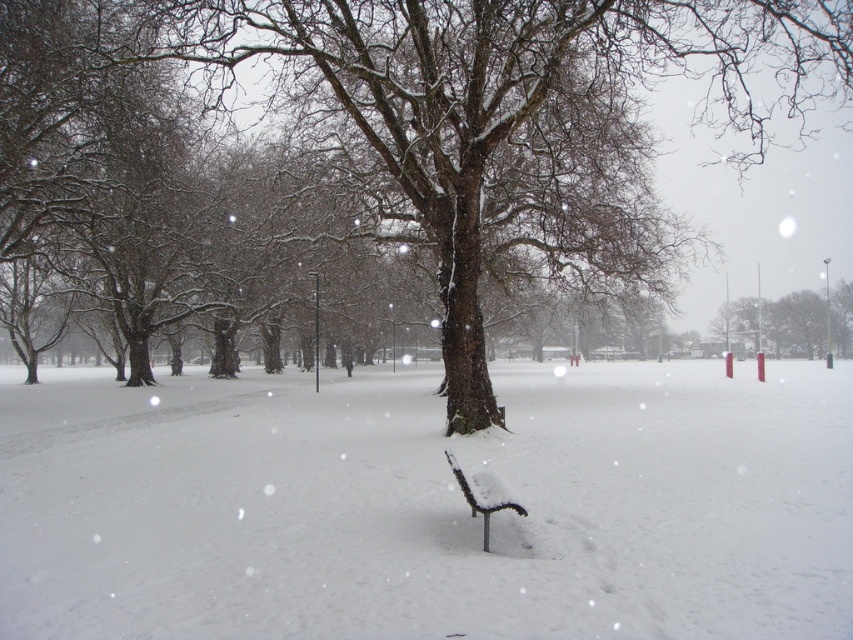
Is smooth red pole at center closer to camera compared to snow-covered wood bench at center?

That is False.

Find the location of a particular element. smooth red pole at center is located at coordinates (785, 323).

Is snow-covered tree at center taller than snow-covered wood bench at center?

Indeed, snow-covered tree at center has a greater height compared to snow-covered wood bench at center.

Is snow-covered tree at center positioned behind snow-covered wood bench at center?

Yes.

Between point (576, 42) and point (445, 456), which one is positioned behind?

The point (576, 42) is behind.

Find the location of a particular element. snow-covered tree at center is located at coordinates (416, 96).

Who is positioned more to the right, snow-covered tree at center or smooth red pole at center?

Positioned to the right is smooth red pole at center.

Can you confirm if snow-covered tree at center is positioned above smooth red pole at center?

Yes, snow-covered tree at center is above smooth red pole at center.

This screenshot has height=640, width=853. Describe the element at coordinates (416, 96) in the screenshot. I see `snow-covered tree at center` at that location.

At what (x,y) coordinates should I click in order to perform the action: click on snow-covered tree at center. Please return your answer as a coordinate pair (x, y). Image resolution: width=853 pixels, height=640 pixels. Looking at the image, I should click on (416, 96).